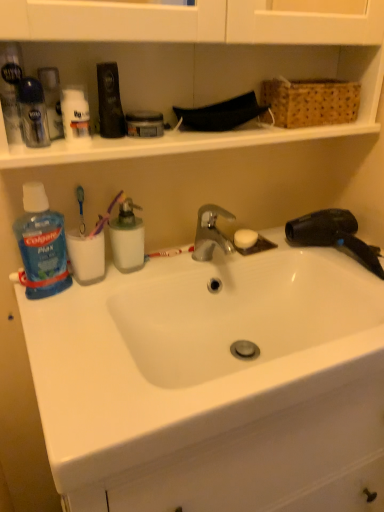
This screenshot has width=384, height=512. Find the location of `vacant region in front of translucent plastic container at center, acting as the 1th cleaning product starting from the right`. vacant region in front of translucent plastic container at center, acting as the 1th cleaning product starting from the right is located at coordinates (92, 311).